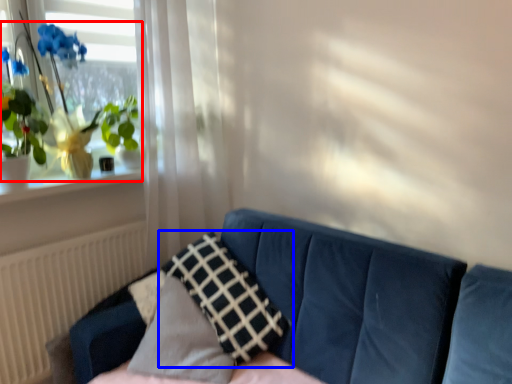
Question: Which object is further to the camera taking this photo, houseplant (highlighted by a red box) or pillow (highlighted by a blue box)?

Choices:
 (A) houseplant
 (B) pillow

Answer: (A)